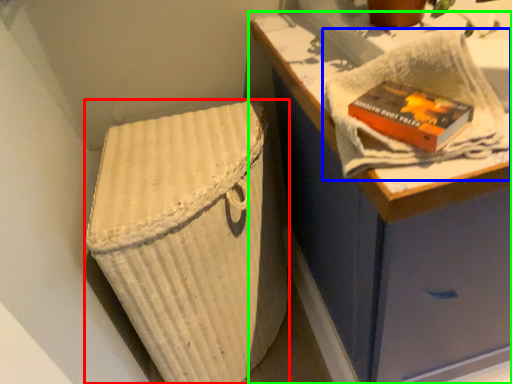
Question: Which object is the farthest from laundry basket (highlighted by a red box)? Choose among these: bath towel (highlighted by a blue box) or furniture (highlighted by a green box).

Choices:
 (A) bath towel
 (B) furniture

Answer: (A)